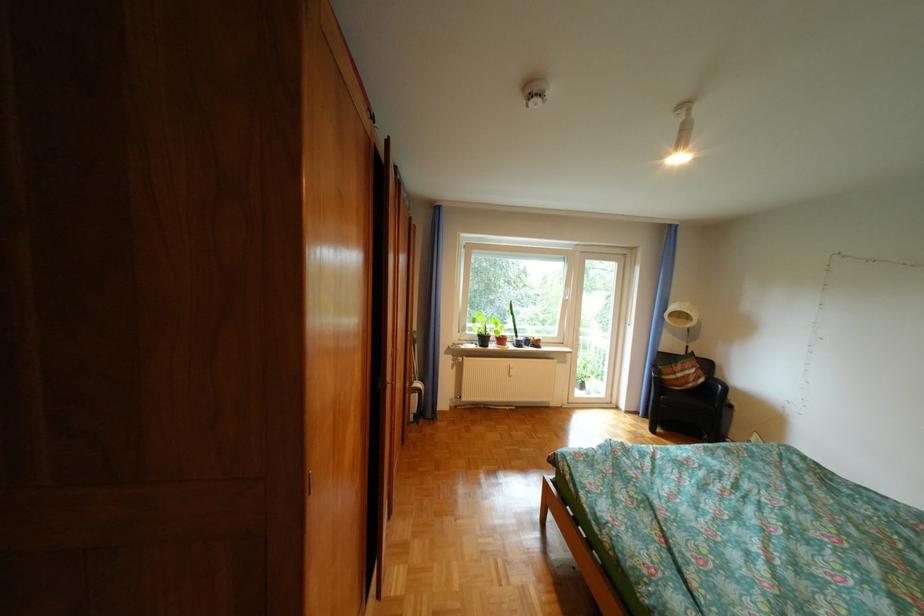
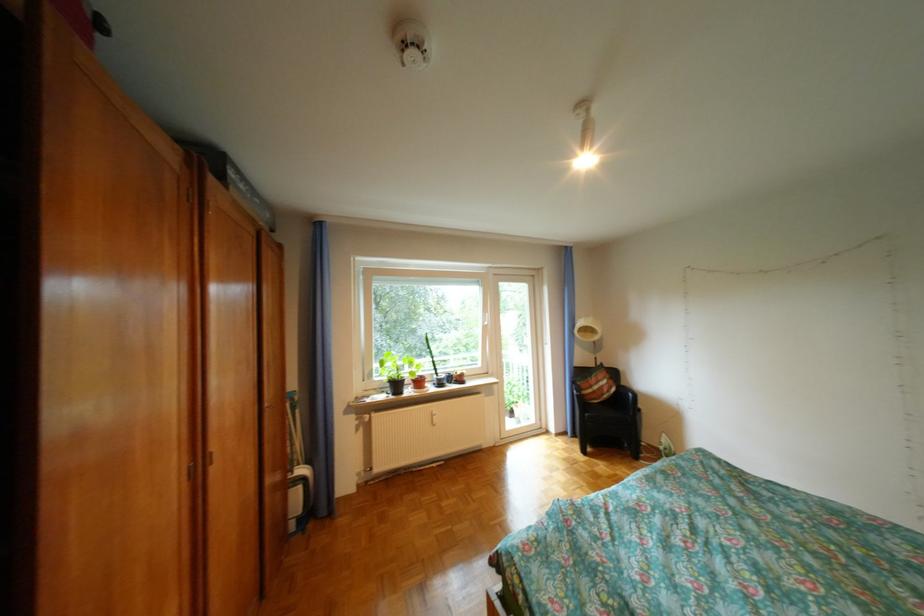
Question: The first image is from the beginning of the video and the second image is from the end. How did the camera likely rotate when shooting the video?

Choices:
 (A) Left
 (B) Right
 (C) Up
 (D) Down

Answer: (B)